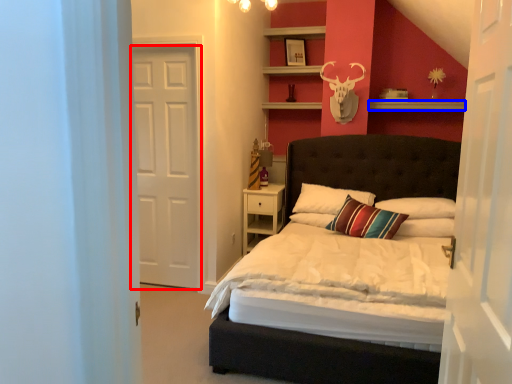
Question: Which of the following is the closest to the observer, door (highlighted by a red box) or shelf (highlighted by a blue box)?

Choices:
 (A) door
 (B) shelf

Answer: (A)